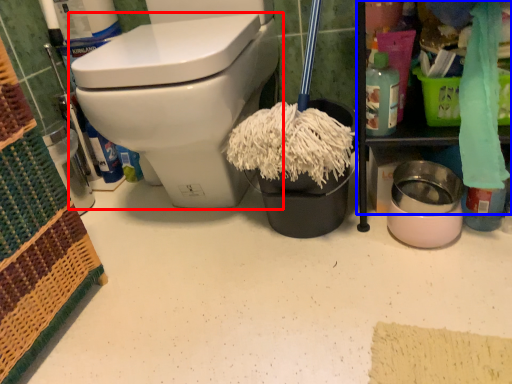
Question: Which of the following is the closest to the observer, toilet (highlighted by a red box) or cabinetry (highlighted by a blue box)?

Choices:
 (A) toilet
 (B) cabinetry

Answer: (B)